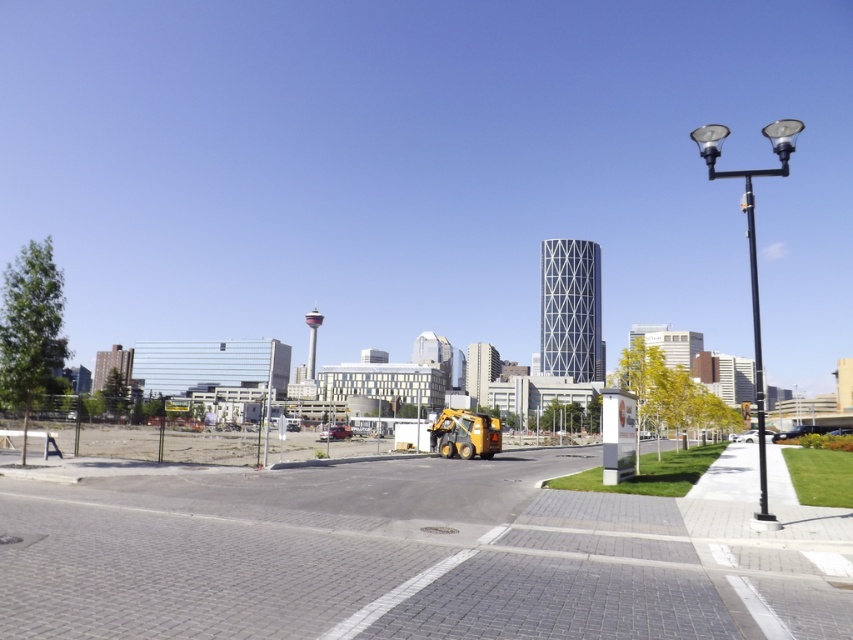
You are a city planner analyzing the urban layout. The yellow compact tractor at center and the black metal lamp post at right are both in the foreground. Which object takes up more space in the image?

The black metal lamp post at right takes up more space in the image than the yellow compact tractor at center because the yellow compact tractor at center occupies less space than black metal lamp post at right.

You are a delivery person trying to navigate through the urban scene. You need to deliver a package to the construction site. The construction site is near the yellow compact tractor at center. Where should you head to find the construction site?

The construction site is near the yellow compact tractor at center, which is located at point (410,556). Head towards that coordinate to reach the construction site.

From the picture: You are a pedestrian standing at the edge of the paved area. You want to walk from the yellow compact tractor at center to the black metal lamp post at right. Which direction should you move to reach the lamp post?

To reach the black metal lamp post at right from the yellow compact tractor at center, you should move to the right since the yellow compact tractor at center is to the left of the black metal lamp post at right.